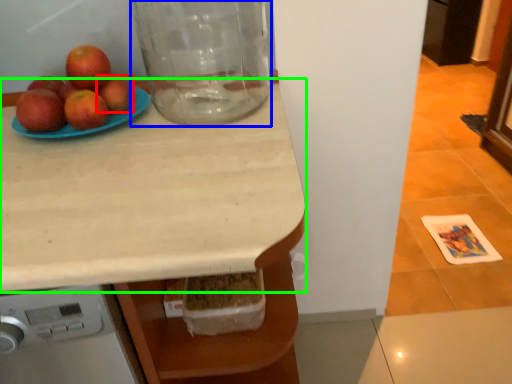
Question: Estimate the real-world distances between objects in this image. Which object is farther from apple (highlighted by a red box), glass jar (highlighted by a blue box) or countertop (highlighted by a green box)?

Choices:
 (A) glass jar
 (B) countertop

Answer: (B)